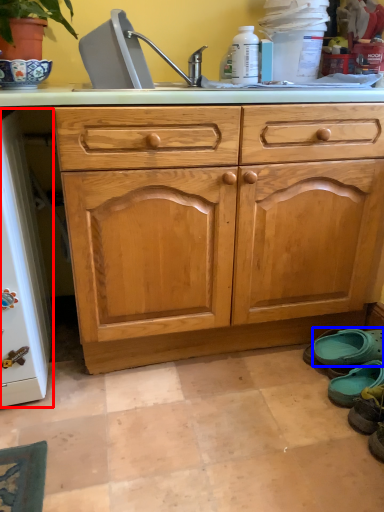
Question: Which object is further to the camera taking this photo, appliance (highlighted by a red box) or footwear (highlighted by a blue box)?

Choices:
 (A) appliance
 (B) footwear

Answer: (B)